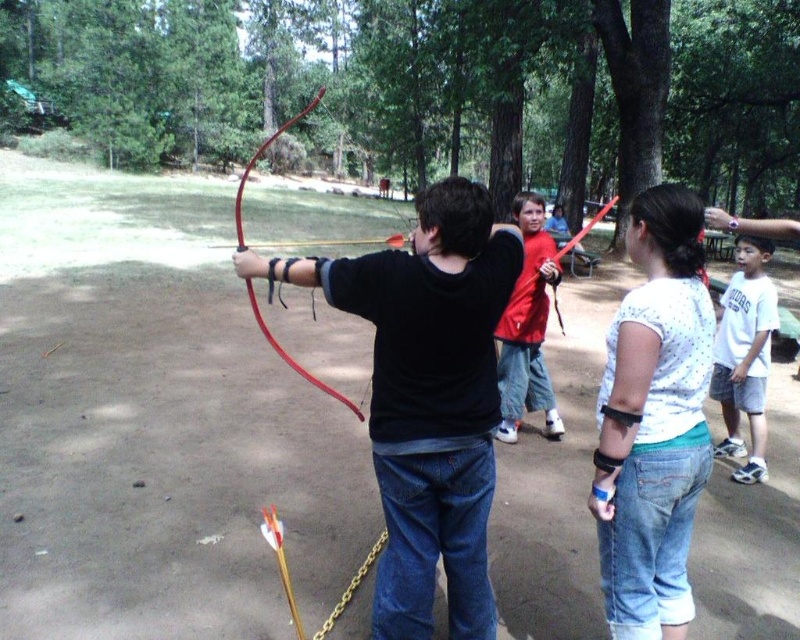
You are an archer standing in the park and see the matte black bow at center. What is the exact coordinate of the bow in the image?

The matte black bow at center is located at point (428, 397).

You are an archer in the park and you see a red cotton shirt at center and a rubber red bow at center. Which object is positioned to the right side?

The red cotton shirt at center is to the right of the rubber red bow at center.